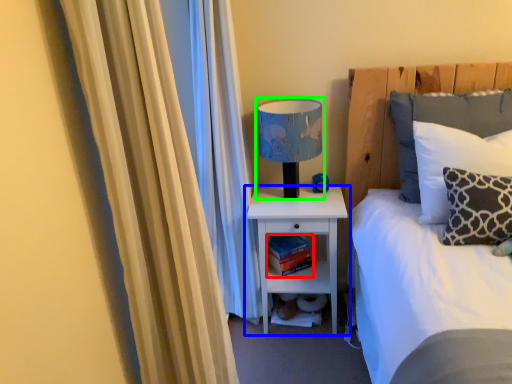
Question: Based on their relative distances, which object is farther from book (highlighted by a red box)? Choose from nightstand (highlighted by a blue box) and table lamp (highlighted by a green box).

Choices:
 (A) nightstand
 (B) table lamp

Answer: (B)